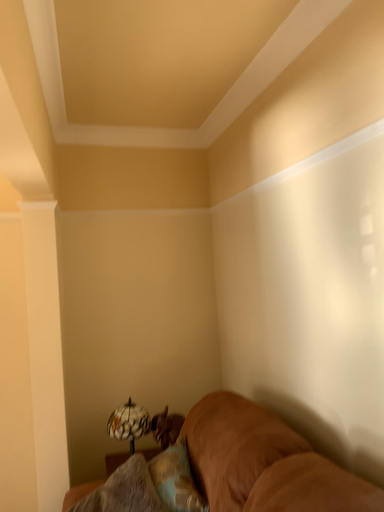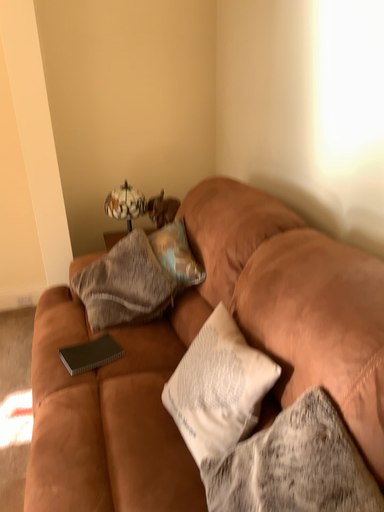
Question: Which way did the camera rotate in the video?

Choices:
 (A) rotated downward
 (B) rotated upward

Answer: (A)